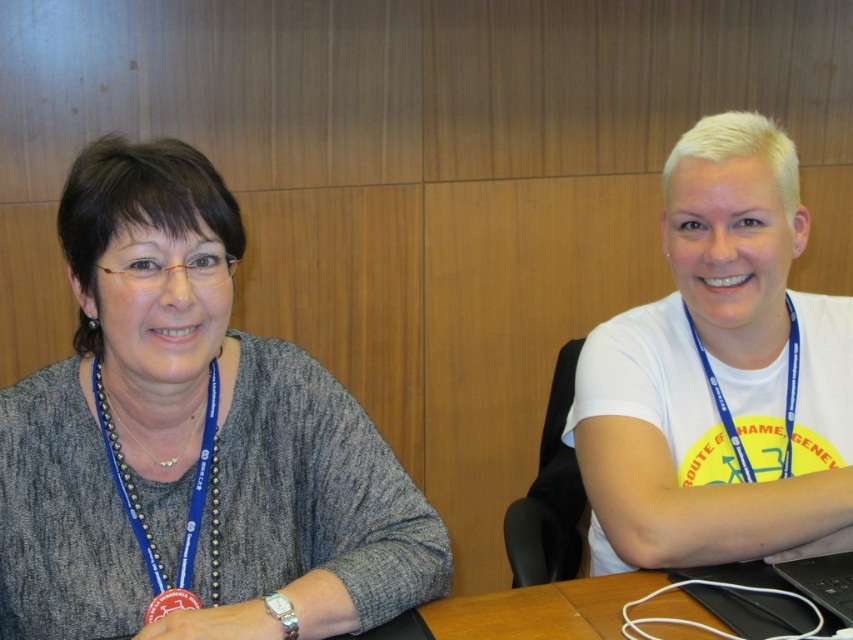
You are an observer in the room. You see the matte gray sweater at left and the blue fabric lanyard at left. Which object is wider?

The matte gray sweater at left is wider than the blue fabric lanyard at left.